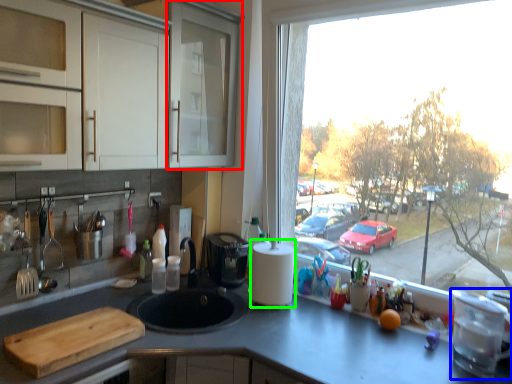
Question: Based on their relative distances, which object is farther from screen door (highlighted by a red box)? Choose from appliance (highlighted by a blue box) and paper towel (highlighted by a green box).

Choices:
 (A) appliance
 (B) paper towel

Answer: (A)